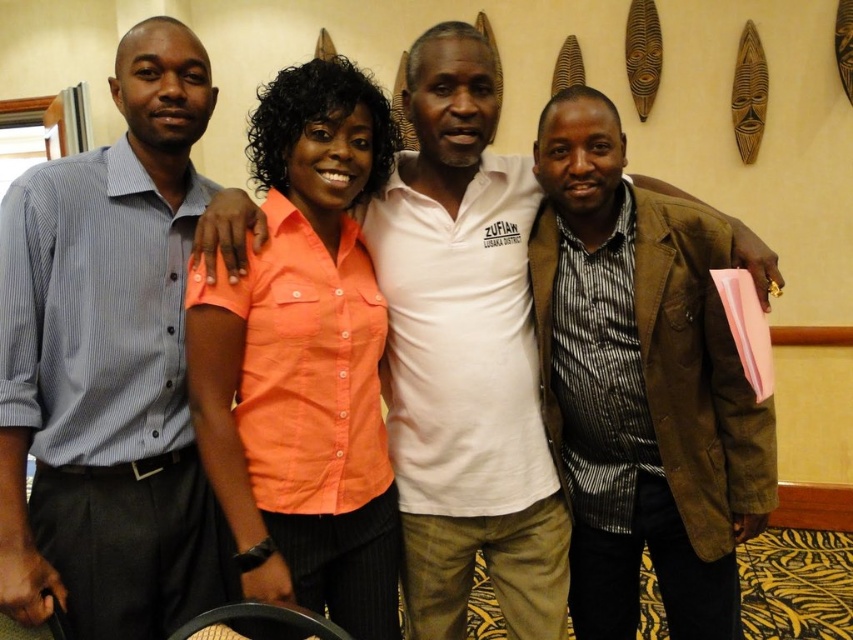
Question: Which point is closer to the camera?

Choices:
 (A) (554, 189)
 (B) (431, 140)
 (C) (286, 314)
 (D) (161, 492)

Answer: (C)

Question: Can you confirm if brown textured blazer at right is positioned to the left of white cotton shirt at center?

Choices:
 (A) no
 (B) yes

Answer: (A)

Question: Which of the following is the closest to the observer?

Choices:
 (A) brown textured blazer at right
 (B) blue striped shirt at left

Answer: (B)

Question: Is white cotton shirt at center above orange cotton shirt at center?

Choices:
 (A) yes
 (B) no

Answer: (A)

Question: Among these objects, which one is nearest to the camera?

Choices:
 (A) white cotton shirt at center
 (B) brown textured blazer at right
 (C) orange cotton shirt at center

Answer: (C)

Question: Observing the image, what is the correct spatial positioning of white cotton shirt at center in reference to orange cotton shirt at center?

Choices:
 (A) above
 (B) below

Answer: (A)